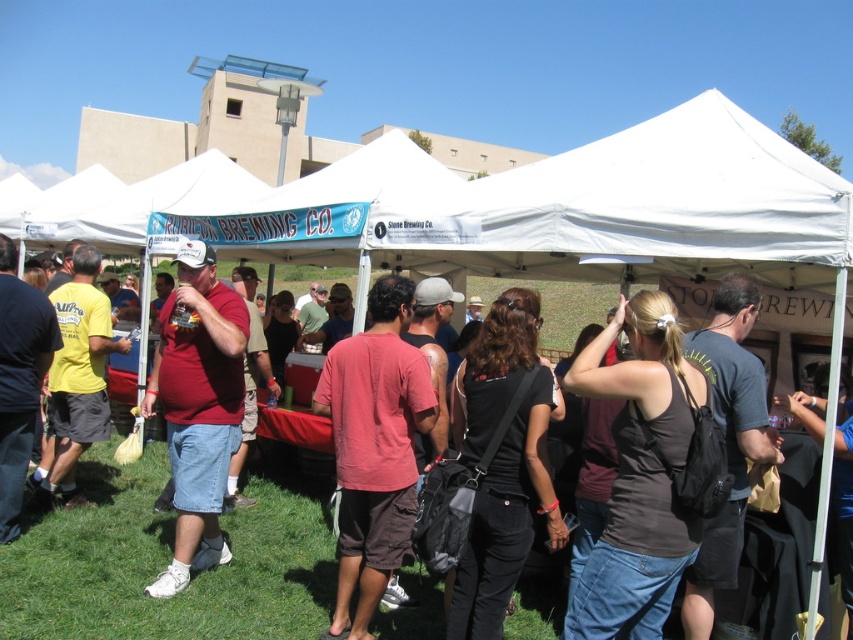
Question: Can you confirm if black matte tank top at center is bigger than brown cotton shirt at center?

Choices:
 (A) no
 (B) yes

Answer: (B)

Question: Which object appears farthest from the camera in this image?

Choices:
 (A) matte red shirt at center
 (B) brown cotton shirt at center
 (C) black matte tank top at center

Answer: (A)

Question: Can you confirm if black matte tank top at center is thinner than brown cotton shirt at center?

Choices:
 (A) no
 (B) yes

Answer: (B)

Question: Which of the following is the farthest from the observer?

Choices:
 (A) brown cotton shirt at center
 (B) black matte tank top at center

Answer: (A)

Question: Which point is farther from the camera taking this photo?

Choices:
 (A) [699, 376]
 (B) [383, 570]

Answer: (B)

Question: Can you confirm if brown cotton shirt at center is smaller than matte red shirt at center?

Choices:
 (A) no
 (B) yes

Answer: (B)